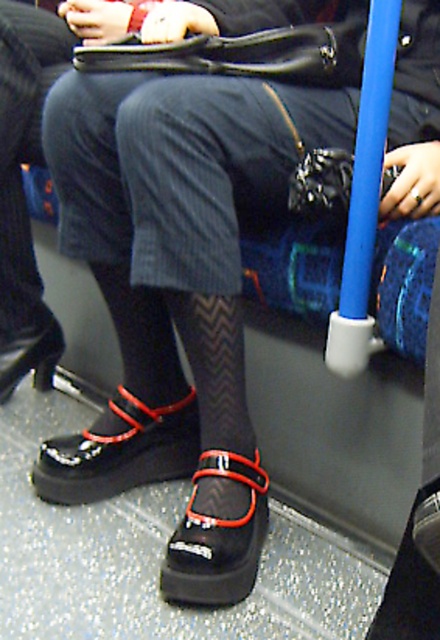
Question: Does black mesh tights at lower center have a larger size compared to black suede mary jane shoes at lower center?

Choices:
 (A) no
 (B) yes

Answer: (B)

Question: Observing the image, what is the correct spatial positioning of black suede mary jane shoes at lower center in reference to black leather mary jane shoe at lower center?

Choices:
 (A) right
 (B) left

Answer: (B)

Question: Which of the following is the closest to the observer?

Choices:
 (A) (43, 346)
 (B) (11, 324)
 (C) (223, 456)

Answer: (C)

Question: Which is farther from the black suede mary jane shoes at lower center?

Choices:
 (A) black leather shoe at lower left
 (B) black leather mary jane shoe at lower center
 (C) black mesh tights at lower center

Answer: (C)

Question: Which is nearer to the black mesh tights at lower center?

Choices:
 (A) black leather mary jane shoe at lower center
 (B) black leather shoe at lower left
 (C) black suede mary jane shoes at lower center

Answer: (B)

Question: Is black leather mary jane shoe at lower center to the left of black leather shoe at lower left from the viewer's perspective?

Choices:
 (A) yes
 (B) no

Answer: (B)